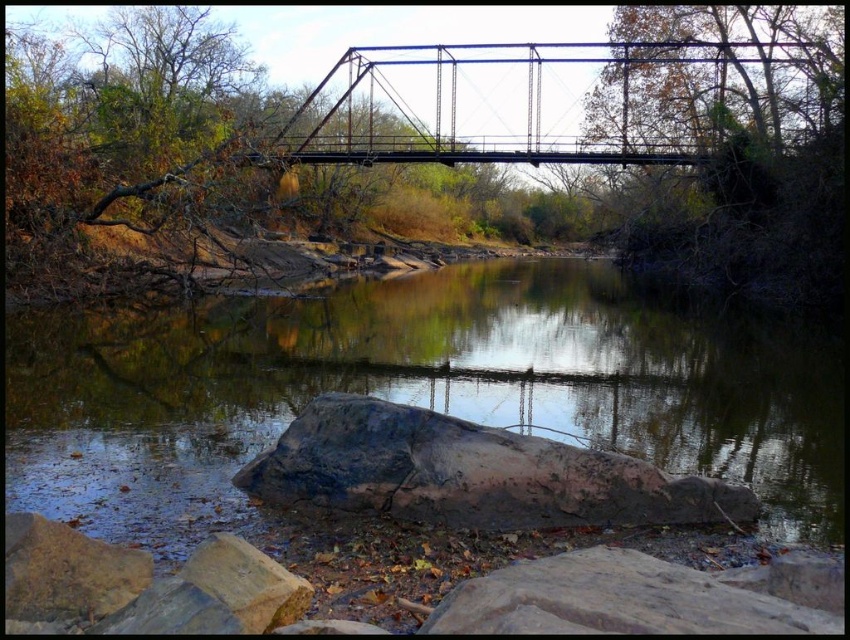
You are standing on the metal truss bridge and looking towards the river. There are two points marked on the bridge deck. The first point is at coordinate point (115, 362) and the second point is at coordinate point (581, 51). Which point is closer to you when you are facing the river?

Point (115, 362) is in front of point (581, 51), so the first point is closer to you when facing the river.

You are a boat captain trying to navigate a narrow boat through the river under the metallic bridge at upper center. The boat is as wide as the smooth brown water at center. Will the boat fit under the bridge?

The smooth brown water at center is narrower than the metallic bridge at upper center, so the boat, which is as wide as the water, will fit under the bridge since the bridge is wider than the water.

You are a photographer planning to capture the reflection of the smooth brown water at center and the gray rough rock at lower center in the river. Since you want to include both elements in your shot, which object should you focus on to ensure both are visible in the frame?

The smooth brown water at center has a larger size compared to the gray rough rock at lower center, so focusing on the smooth brown water at center will ensure both objects are visible in the frame since it occupies more space.